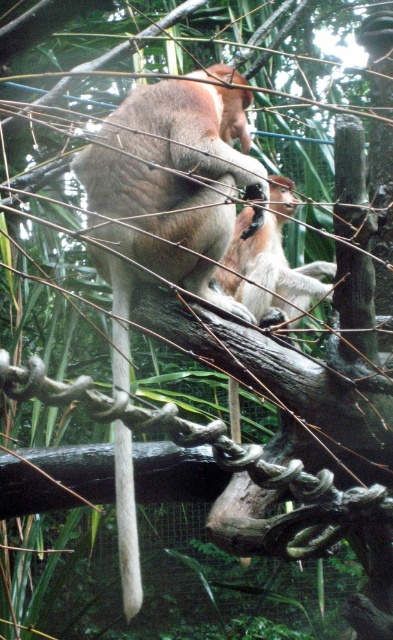
From the picture: You are standing in front of the enclosure watching the proboscis monkeys. There is a point marked at coordinates point (271,276) in the image. If you want to throw a small treat to that point, will it land within 3 meters of where you are standing?

The point (271,276) is 3.48 meters away from the viewer, so the treat will land beyond 3 meters from where you are standing.

You are a zookeeper observing the monkeys in their enclosure. You see the brown furry proboscis monkey at center and the white matte tail at center. Which one is positioned more to the left?

The white matte tail at center is positioned more to the left because the brown furry proboscis monkey at center is to the right of it.